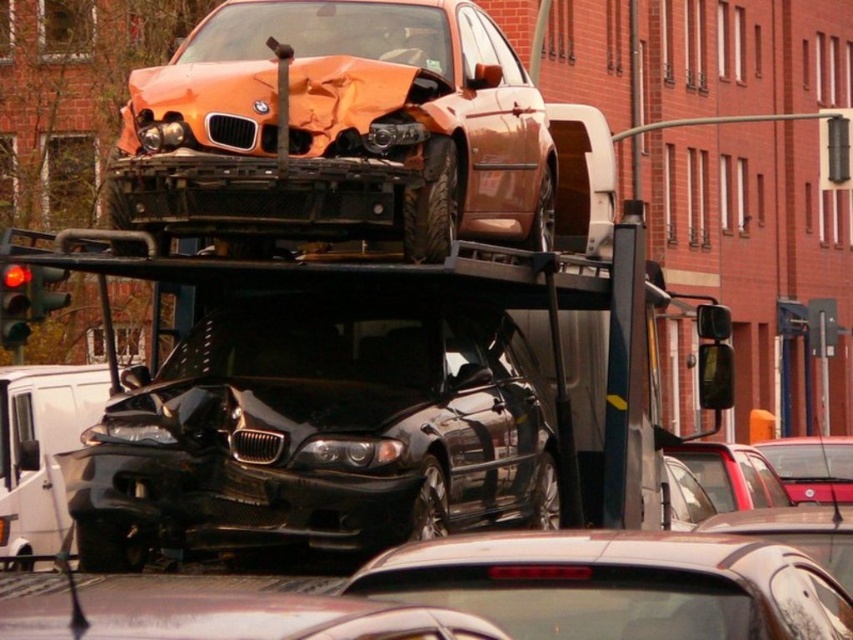
You are a tow truck driver who needs to load a third vehicle onto your truck. The truck currently has two cars already loaded, a metallic red car at center and a metallic red sedan at center. You have a height restriction of 1.8 meters. Which of the two cars currently on the truck is more likely to allow space for the new vehicle without exceeding the height limit?

The metallic red car at center is not as tall as the metallic red sedan at center, so the metallic red car at center would take up less vertical space, allowing more room for the new vehicle without exceeding the height limit.

You are a tow truck operator assessing the load on your truck. You have a shiny metallic car at center and an orange matte car at upper center on the flatbed. Which car takes up more space on the flatbed?

The orange matte car at upper center takes up more space on the flatbed because it is larger than the shiny metallic car at center.